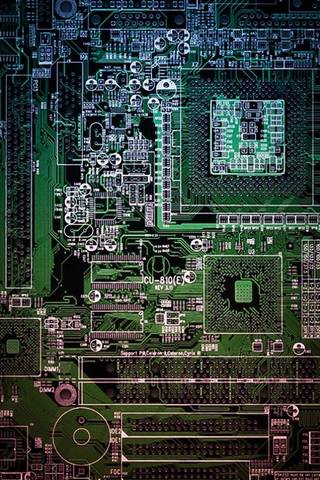
This screenshot has height=480, width=320. What are the coordinates of `computer` in the screenshot? It's located at (196, 170).